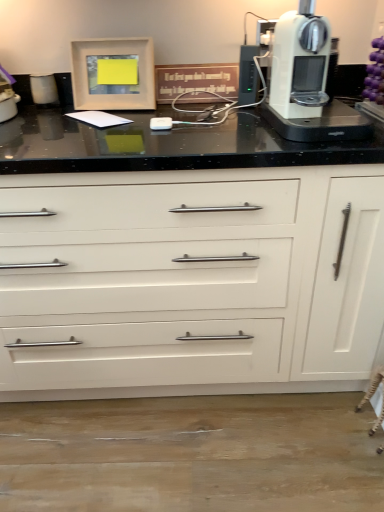
Question: Is matte white trash can at left bigger than white plastic coffee machine at upper right?

Choices:
 (A) yes
 (B) no

Answer: (B)

Question: Does matte white trash can at left lie in front of white plastic coffee machine at upper right?

Choices:
 (A) no
 (B) yes

Answer: (A)

Question: Can you confirm if matte white trash can at left is smaller than white plastic coffee machine at upper right?

Choices:
 (A) yes
 (B) no

Answer: (A)

Question: Is matte white trash can at left aimed at white plastic coffee machine at upper right?

Choices:
 (A) no
 (B) yes

Answer: (A)

Question: Is matte white trash can at left positioned beyond the bounds of white plastic coffee machine at upper right?

Choices:
 (A) yes
 (B) no

Answer: (A)

Question: From the image's perspective, relative to white glossy cabinet at center, is matte white trash can at left above or below?

Choices:
 (A) below
 (B) above

Answer: (B)

Question: Is matte white trash can at left in front of or behind white glossy cabinet at center in the image?

Choices:
 (A) behind
 (B) front

Answer: (A)

Question: From a real-world perspective, is matte white trash can at left above or below white glossy cabinet at center?

Choices:
 (A) above
 (B) below

Answer: (A)

Question: Is matte white trash can at left spatially inside white glossy cabinet at center, or outside of it?

Choices:
 (A) outside
 (B) inside

Answer: (B)

Question: Considering the positions of point (261, 229) and point (306, 49), is point (261, 229) closer or farther from the camera than point (306, 49)?

Choices:
 (A) farther
 (B) closer

Answer: (A)

Question: Is white glossy cabinet at center situated inside white plastic coffee machine at upper right or outside?

Choices:
 (A) inside
 (B) outside

Answer: (B)

Question: Looking at the image, does white glossy cabinet at center seem bigger or smaller compared to white plastic coffee machine at upper right?

Choices:
 (A) big
 (B) small

Answer: (A)

Question: From the image's perspective, is white glossy cabinet at center located above or below white plastic coffee machine at upper right?

Choices:
 (A) below
 (B) above

Answer: (A)

Question: Considering their positions, is matte white trash can at left located in front of or behind white plastic coffee machine at upper right?

Choices:
 (A) front
 (B) behind

Answer: (B)

Question: Is point (29, 81) positioned closer to the camera than point (329, 41)?

Choices:
 (A) farther
 (B) closer

Answer: (A)